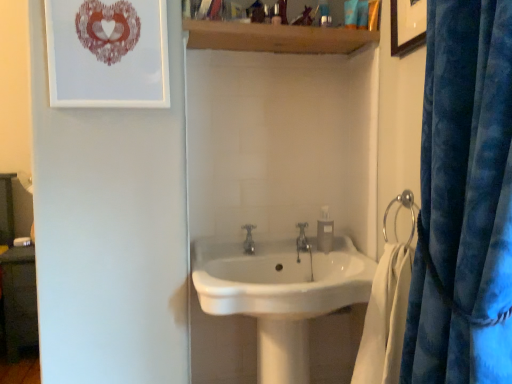
Describe the element at coordinates (108, 53) in the screenshot. I see `matte paper picture frame at upper left, the 1th picture frame positioned from the left` at that location.

Locate an element on the screen. velvet blue curtain at right is located at coordinates click(464, 201).

The image size is (512, 384). Find the location of `silver metallic towel ring at right`. silver metallic towel ring at right is located at coordinates (397, 214).

In order to face wooden picture frame at upper right, which is counted as the second picture frame, starting from the left, should I rotate leftwards or rightwards?

You should rotate right by 20.547 degrees.

The height and width of the screenshot is (384, 512). Describe the element at coordinates (276, 15) in the screenshot. I see `translucent plastic soap dispenser at upper center` at that location.

Where is `translucent plastic soap dispenser at upper center`? The image size is (512, 384). translucent plastic soap dispenser at upper center is located at coordinates (276, 15).

What is the approximate height of wooden shelf at upper center?

wooden shelf at upper center is 7.68 inches in height.

The height and width of the screenshot is (384, 512). I want to click on matte paper picture frame at upper left, the 1th picture frame positioned from the left, so coord(108,53).

Are white glossy sink at center and wooden picture frame at upper right, which ranks as the 1th picture frame in right-to-left order, making contact?

white glossy sink at center and wooden picture frame at upper right, which ranks as the 1th picture frame in right-to-left order, are not in contact.

From the image's perspective, who appears lower, white glossy sink at center or wooden picture frame at upper right, which is counted as the second picture frame, starting from the left?

white glossy sink at center.

Is point (347, 287) farther from camera compared to point (393, 3)?

No, it is in front of (393, 3).

Are silver metallic tap at center, the second tap in the left-to-right sequence, and silver metallic towel ring at right located far from each other?

No.

In terms of height, does silver metallic tap at center, positioned as the first tap in right-to-left order, look taller or shorter compared to silver metallic towel ring at right?

silver metallic tap at center, positioned as the first tap in right-to-left order, is shorter than silver metallic towel ring at right.

Based on the photo, does silver metallic tap at center, the second tap in the left-to-right sequence, have a greater width compared to silver metallic towel ring at right?

Yes, silver metallic tap at center, the second tap in the left-to-right sequence, is wider than silver metallic towel ring at right.

Does point (297, 242) appear closer or farther from the camera than point (414, 231)?

Point (297, 242) appears to be farther away from the viewer than point (414, 231).

Identify the location of the 1st picture frame above the silver metallic tap at center, the second tap in the left-to-right sequence (from the image's perspective). The height and width of the screenshot is (384, 512). (108, 53).

Does matte paper picture frame at upper left, the 1th picture frame positioned from the left, have a larger size compared to silver metallic tap at center, the second tap in the left-to-right sequence?

Indeed, matte paper picture frame at upper left, the 1th picture frame positioned from the left, has a larger size compared to silver metallic tap at center, the second tap in the left-to-right sequence.

How far apart are matte paper picture frame at upper left, acting as the 2th picture frame starting from the right, and silver metallic tap at center, positioned as the first tap in right-to-left order?

They are 34.01 inches apart.

Can silver metallic tap at center, the second tap in the left-to-right sequence, be found inside matte paper picture frame at upper left, acting as the 2th picture frame starting from the right?

No, silver metallic tap at center, the second tap in the left-to-right sequence, is not inside matte paper picture frame at upper left, acting as the 2th picture frame starting from the right.

In the scene shown: Which is more to the right, clear plastic soap dispenser at center or silver metallic tap at center, positioned as the first tap in right-to-left order?

clear plastic soap dispenser at center.

Locate an element on the screen. The image size is (512, 384). soap dispenser above the silver metallic tap at center, positioned as the first tap in right-to-left order (from a real-world perspective) is located at coordinates (325, 231).

Looking at this image, from the image's perspective, which is above, clear plastic soap dispenser at center or silver metallic tap at center, positioned as the first tap in right-to-left order?

From the image's view, clear plastic soap dispenser at center is above.

Who is smaller, clear plastic soap dispenser at center or silver metallic tap at center, positioned as the first tap in right-to-left order?

silver metallic tap at center, positioned as the first tap in right-to-left order, is smaller.

Does velvet blue curtain at right have a greater height compared to wooden picture frame at upper right, which is counted as the second picture frame, starting from the left?

Yes, velvet blue curtain at right is taller than wooden picture frame at upper right, which is counted as the second picture frame, starting from the left.

Considering the sizes of objects velvet blue curtain at right and wooden picture frame at upper right, which ranks as the 1th picture frame in right-to-left order, in the image provided, who is smaller, velvet blue curtain at right or wooden picture frame at upper right, which ranks as the 1th picture frame in right-to-left order,?

wooden picture frame at upper right, which ranks as the 1th picture frame in right-to-left order.

From the image's perspective, is velvet blue curtain at right beneath wooden picture frame at upper right, which ranks as the 1th picture frame in right-to-left order?

Yes.

Is the position of velvet blue curtain at right less distant than that of wooden picture frame at upper right, which is counted as the second picture frame, starting from the left?

That is True.

Considering the points (303, 229) and (248, 245), which point is behind, point (303, 229) or point (248, 245)?

The point (303, 229) is more distant.

Does silver metallic tap at center, the second tap in the left-to-right sequence, have a greater height compared to satin nickel faucet at center, which appears as the second tap when viewed from the right?

No, silver metallic tap at center, the second tap in the left-to-right sequence, is not taller than satin nickel faucet at center, which appears as the second tap when viewed from the right.

Considering the relative positions of silver metallic tap at center, positioned as the first tap in right-to-left order, and satin nickel faucet at center, which appears as the first tap when viewed from the left, in the image provided, is silver metallic tap at center, positioned as the first tap in right-to-left order, to the left of satin nickel faucet at center, which appears as the first tap when viewed from the left, from the viewer's perspective?

In fact, silver metallic tap at center, positioned as the first tap in right-to-left order, is to the right of satin nickel faucet at center, which appears as the first tap when viewed from the left.

Would you say satin nickel faucet at center, which appears as the first tap when viewed from the left, is part of silver metallic tap at center, the second tap in the left-to-right sequence,'s contents?

No, satin nickel faucet at center, which appears as the first tap when viewed from the left, is not a part of silver metallic tap at center, the second tap in the left-to-right sequence.

From a real-world perspective, is satin nickel faucet at center, which appears as the first tap when viewed from the left, positioned above or below matte paper picture frame at upper left, the 1th picture frame positioned from the left?

From a real-world perspective, satin nickel faucet at center, which appears as the first tap when viewed from the left, is physically below matte paper picture frame at upper left, the 1th picture frame positioned from the left.

Would you consider satin nickel faucet at center, which appears as the second tap when viewed from the right, to be distant from matte paper picture frame at upper left, acting as the 2th picture frame starting from the right?

satin nickel faucet at center, which appears as the second tap when viewed from the right, is actually quite close to matte paper picture frame at upper left, acting as the 2th picture frame starting from the right.

Is satin nickel faucet at center, which appears as the second tap when viewed from the right, shorter than matte paper picture frame at upper left, acting as the 2th picture frame starting from the right?

Yes, satin nickel faucet at center, which appears as the second tap when viewed from the right, is shorter than matte paper picture frame at upper left, acting as the 2th picture frame starting from the right.

Considering the positions of point (252, 248) and point (113, 59), is point (252, 248) closer or farther from the camera than point (113, 59)?

Point (252, 248) is positioned farther from the camera compared to point (113, 59).

This screenshot has width=512, height=384. What are the coordinates of `picture frame to the right of white glossy sink at center` in the screenshot? It's located at (407, 25).

Find the location of a particular element. shower above the silver metallic tap at center, positioned as the first tap in right-to-left order (from a real-world perspective) is located at coordinates (397, 214).

When comparing their distances from wooden picture frame at upper right, which ranks as the 1th picture frame in right-to-left order, does silver metallic towel ring at right or wooden shelf at upper center seem closer?

Among the two, wooden shelf at upper center is located nearer to wooden picture frame at upper right, which ranks as the 1th picture frame in right-to-left order.

Estimate the real-world distances between objects in this image. Which object is further from silver metallic towel ring at right, clear plastic soap dispenser at center or white glossy sink at center?

Based on the image, white glossy sink at center appears to be further to silver metallic towel ring at right.

Looking at this image, from the image, which object appears to be farther from silver metallic tap at center, the second tap in the left-to-right sequence, velvet blue curtain at right or silver metallic towel ring at right?

velvet blue curtain at right lies further to silver metallic tap at center, the second tap in the left-to-right sequence, than the other object.

From the image, which object appears to be farther from silver metallic tap at center, the second tap in the left-to-right sequence, silver metallic towel ring at right or matte paper picture frame at upper left, acting as the 2th picture frame starting from the right?

Based on the image, matte paper picture frame at upper left, acting as the 2th picture frame starting from the right, appears to be further to silver metallic tap at center, the second tap in the left-to-right sequence.

From the image, which object appears to be farther from clear plastic soap dispenser at center, matte paper picture frame at upper left, acting as the 2th picture frame starting from the right, or silver metallic towel ring at right?

Based on the image, matte paper picture frame at upper left, acting as the 2th picture frame starting from the right, appears to be further to clear plastic soap dispenser at center.

From the image, which object appears to be nearer to translucent plastic soap dispenser at upper center, silver metallic tap at center, positioned as the first tap in right-to-left order, or wooden picture frame at upper right, which is counted as the second picture frame, starting from the left?

The object closer to translucent plastic soap dispenser at upper center is wooden picture frame at upper right, which is counted as the second picture frame, starting from the left.

Consider the image. When comparing their distances from white soft towel at lower right, does clear plastic soap dispenser at center or silver metallic towel ring at right seem further?

Based on the image, clear plastic soap dispenser at center appears to be further to white soft towel at lower right.

Looking at the image, which one is located closer to silver metallic towel ring at right, white glossy sink at center or satin nickel faucet at center, which appears as the first tap when viewed from the left?

white glossy sink at center is positioned closer to the anchor silver metallic towel ring at right.

This screenshot has height=384, width=512. Find the location of `bath towel between velvet blue curtain at right and clear plastic soap dispenser at center along the z-axis`. bath towel between velvet blue curtain at right and clear plastic soap dispenser at center along the z-axis is located at coordinates (385, 319).

What are the coordinates of `toiletry positioned between velvet blue curtain at right and satin nickel faucet at center, which appears as the second tap when viewed from the right, from near to far` in the screenshot? It's located at (276, 15).

Find the location of a particular element. The image size is (512, 384). bath towel between white glossy sink at center and clear plastic soap dispenser at center along the z-axis is located at coordinates (385, 319).

The width and height of the screenshot is (512, 384). I want to click on shower between velvet blue curtain at right and wooden shelf at upper center from front to back, so click(x=397, y=214).